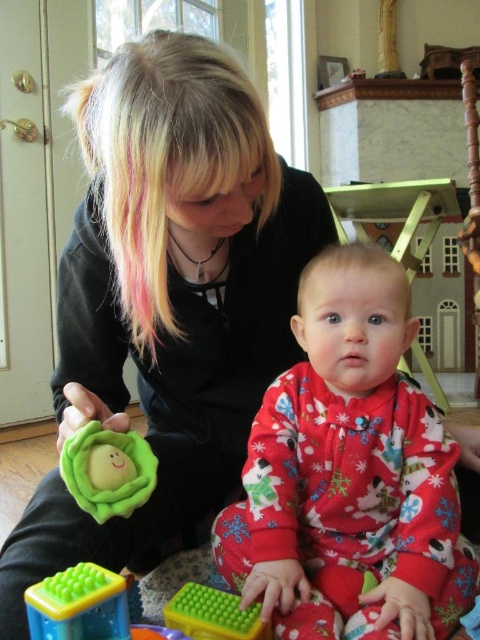
Question: Is matte black sweater at center thinner than fluffy red pajamas at center?

Choices:
 (A) yes
 (B) no

Answer: (B)

Question: Which object appears farthest from the camera in this image?

Choices:
 (A) green plastic toy at lower center
 (B) matte black sweater at center
 (C) green rubbery textured toy at lower center

Answer: (C)

Question: Does matte black sweater at center appear under green plastic toy at lower center?

Choices:
 (A) no
 (B) yes

Answer: (A)

Question: Which point is farther to the camera?

Choices:
 (A) (31, 605)
 (B) (120, 436)

Answer: (B)

Question: Is matte black sweater at center to the right of green plastic toy at lower center from the viewer's perspective?

Choices:
 (A) yes
 (B) no

Answer: (A)

Question: Among these points, which one is farthest from the camera?

Choices:
 (A) (242, 84)
 (B) (94, 484)

Answer: (B)